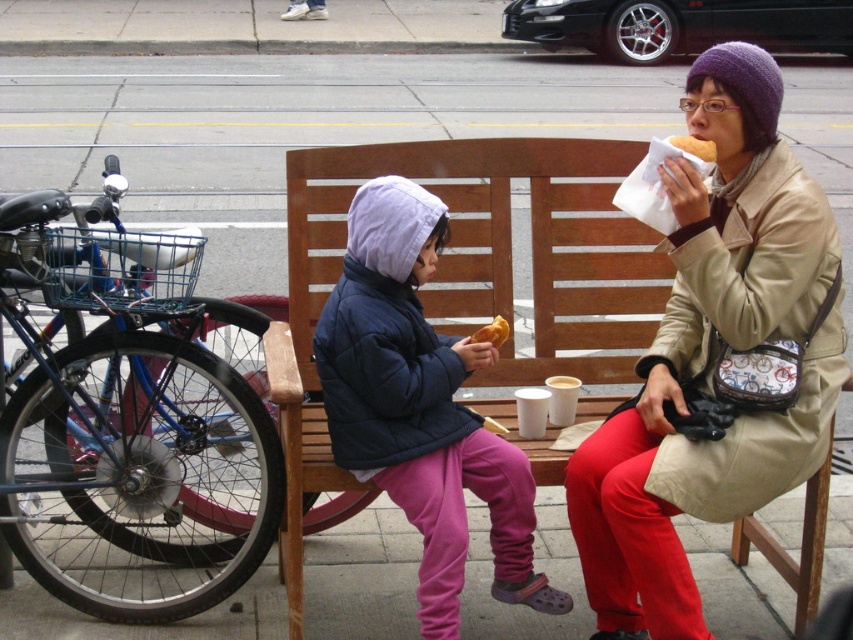
You are standing 10 feet away from the bench where the child and adult are sitting. There is a point at coordinates point (709, 161). Is this point closer to you than the bench?

The distance of point (709, 161) from viewer is 9.62 feet, so yes, the point is closer to you than the bench because you are standing 10 feet away from the bench.

Looking at this image, you are a delivery person who needs to place a small package between the beige leather jacket at center and the golden bread at center on the bench. The package is 20 centimeters long. Will there be enough space between them to fit the package?

The beige leather jacket at center and golden bread at center are 67.12 centimeters apart. Since the package is only 20 centimeters long, there is sufficient space between them to place the package.